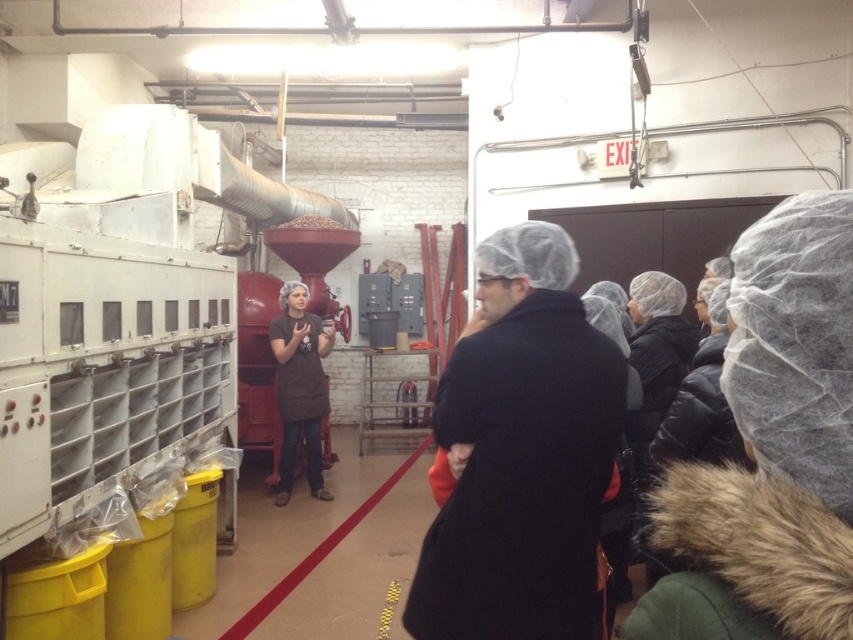
Does black wool coat at center have a lesser width compared to red rubber line at center?

No.

Does black wool coat at center appear over red rubber line at center?

Yes, black wool coat at center is above red rubber line at center.

Between point (569, 531) and point (262, 618), which one is positioned behind?

The point (262, 618) is more distant.

Locate an element on the screen. black wool coat at center is located at coordinates (520, 452).

Measure the distance between point (604, 355) and camera.

Point (604, 355) is 6.39 feet away from camera.

Find the location of a particular element. black wool coat at center is located at coordinates (520, 452).

Is brown fabric apron at center to the left of red rubber line at center from the viewer's perspective?

Indeed, brown fabric apron at center is positioned on the left side of red rubber line at center.

Which is above, brown fabric apron at center or red rubber line at center?

brown fabric apron at center is higher up.

Which is in front, point (309, 436) or point (286, 588)?

Point (286, 588) is more forward.

Identify the location of brown fabric apron at center. The image size is (853, 640). (299, 387).